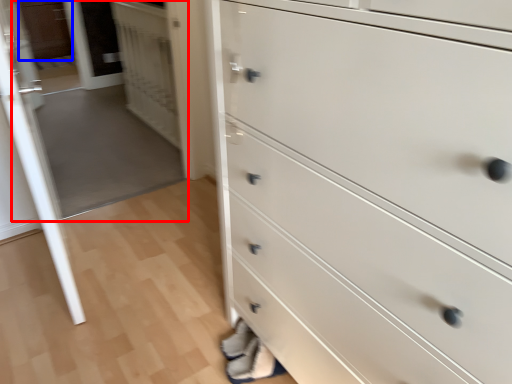
Question: Which of the following is the closest to the observer, glass door (highlighted by a red box) or cabinetry (highlighted by a blue box)?

Choices:
 (A) glass door
 (B) cabinetry

Answer: (A)